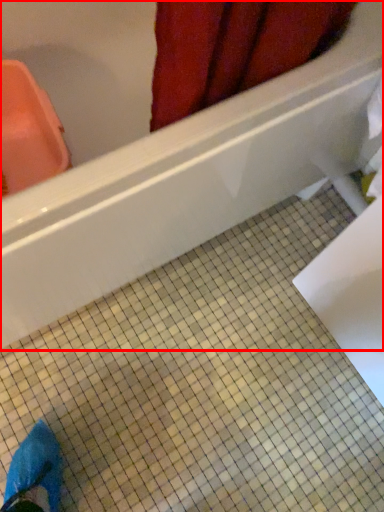
Question: Observing the image, what is the correct spatial positioning of bathtub (annotated by the red box) in reference to ceramic tile?

Choices:
 (A) right
 (B) left

Answer: (B)